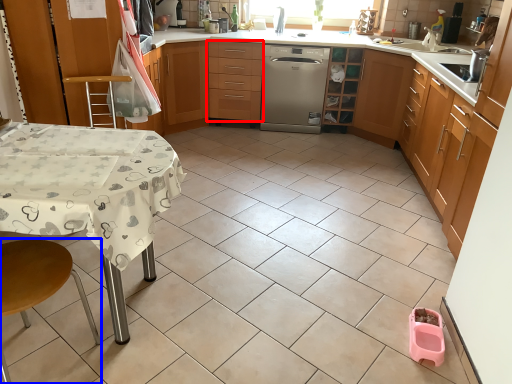
Question: Which object is further to the camera taking this photo, drawer (highlighted by a red box) or step stool (highlighted by a blue box)?

Choices:
 (A) drawer
 (B) step stool

Answer: (A)